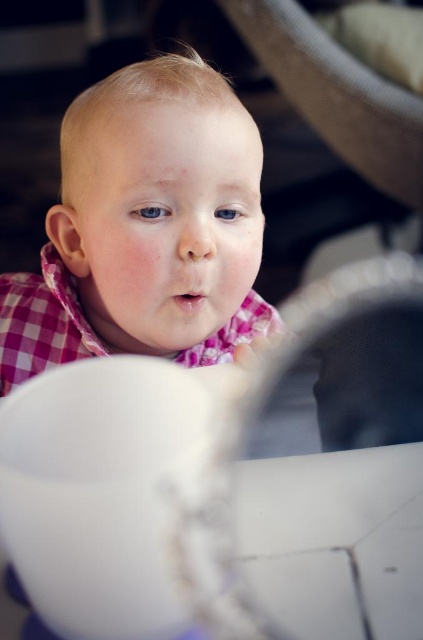
Looking at this image, is pink checkered bib at center thinner than white matte bowl at lower center?

In fact, pink checkered bib at center might be wider than white matte bowl at lower center.

Does pink checkered bib at center come behind white matte bowl at lower center?

Yes, it is.

Does point (112, 202) come farther from viewer compared to point (85, 372)?

Yes.

Where is `pink checkered bib at center`? The width and height of the screenshot is (423, 640). pink checkered bib at center is located at coordinates (145, 227).